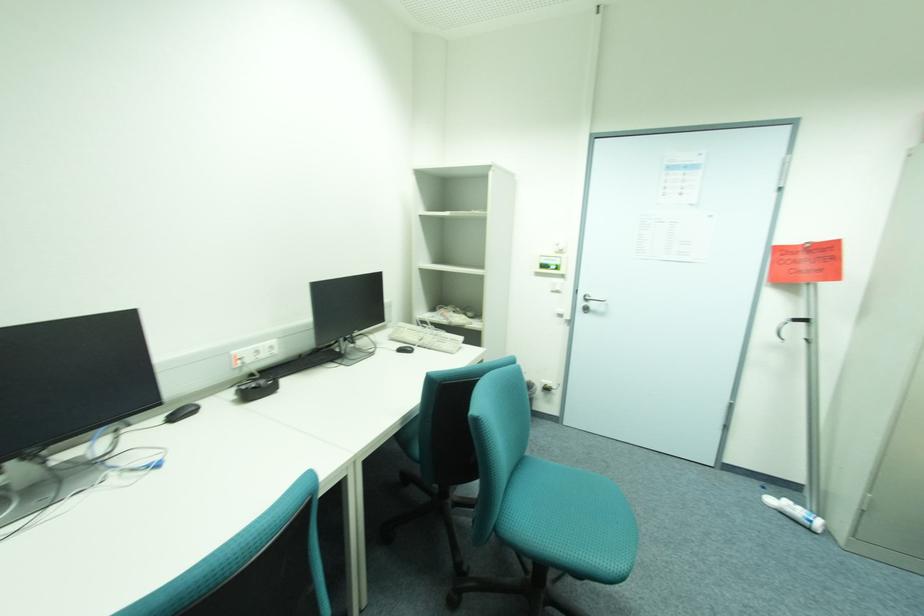
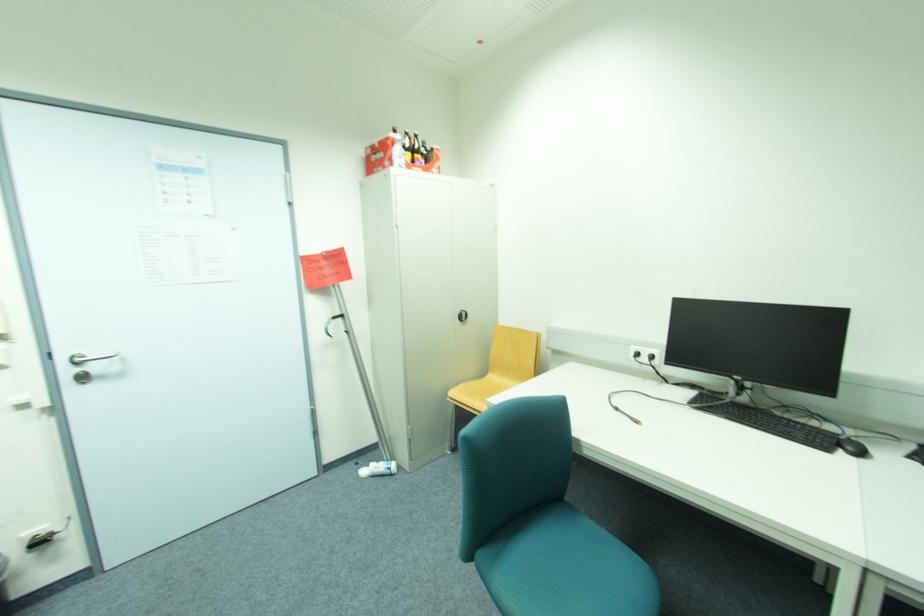
Find the pixel in the second image that matches (x=784, y=498) in the first image.

(373, 468)